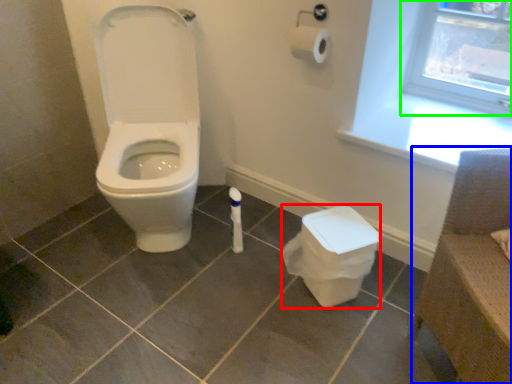
Question: Considering the real-world distances, which object is closest to potty (highlighted by a red box)? chair (highlighted by a blue box) or window frame (highlighted by a green box).

Choices:
 (A) chair
 (B) window frame

Answer: (A)